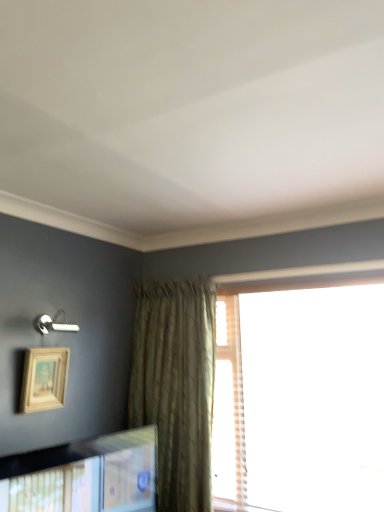
Question: From the image's perspective, relative to translucent plaid curtain at right, is wooden picture frame at upper left, which is the 2th picture frame in bottom-to-top order, above or below?

Choices:
 (A) below
 (B) above

Answer: (B)

Question: In the image, is wooden picture frame at upper left, which is the 2th picture frame in bottom-to-top order, on the left side or the right side of translucent plaid curtain at right?

Choices:
 (A) left
 (B) right

Answer: (A)

Question: Which is nearer to the wooden picture frame at lower left, the first picture frame when ordered from bottom to top?

Choices:
 (A) wooden picture frame at upper left, which is the 2th picture frame in bottom-to-top order
 (B) translucent plaid curtain at right

Answer: (A)

Question: Based on their relative distances, which object is farther from the wooden picture frame at upper left, positioned as the first picture frame in top-to-bottom order?

Choices:
 (A) wooden picture frame at lower left, the first picture frame when ordered from bottom to top
 (B) translucent plaid curtain at right

Answer: (B)